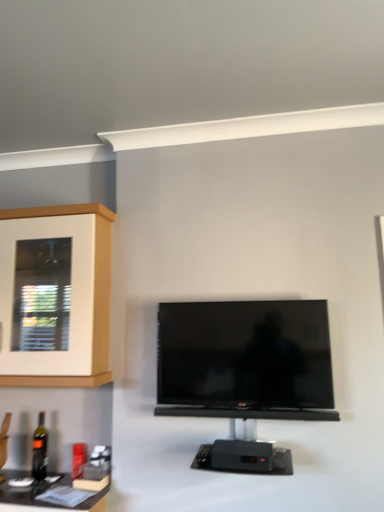
Question: Is black glossy tv at center to the left of black glass bottle at lower left from the viewer's perspective?

Choices:
 (A) yes
 (B) no

Answer: (B)

Question: Would you say black glossy tv at center is a long distance from black glass bottle at lower left?

Choices:
 (A) yes
 (B) no

Answer: (A)

Question: Would you say black glossy tv at center is outside black glass bottle at lower left?

Choices:
 (A) yes
 (B) no

Answer: (A)

Question: Does black glossy tv at center have a smaller size compared to black glass bottle at lower left?

Choices:
 (A) no
 (B) yes

Answer: (A)

Question: Is black glossy tv at center thinner than black glass bottle at lower left?

Choices:
 (A) yes
 (B) no

Answer: (B)

Question: From the image's perspective, would you say black glossy tv at center is shown under black glass bottle at lower left?

Choices:
 (A) no
 (B) yes

Answer: (A)

Question: Is black glass bottle at lower left far away from wooden cabinet at left?

Choices:
 (A) no
 (B) yes

Answer: (A)

Question: Is black glass bottle at lower left positioned beyond the bounds of wooden cabinet at left?

Choices:
 (A) no
 (B) yes

Answer: (B)

Question: Considering the relative positions of black glass bottle at lower left and wooden cabinet at left in the image provided, is black glass bottle at lower left to the left of wooden cabinet at left from the viewer's perspective?

Choices:
 (A) no
 (B) yes

Answer: (B)

Question: From the image's perspective, would you say black glass bottle at lower left is positioned over wooden cabinet at left?

Choices:
 (A) no
 (B) yes

Answer: (A)

Question: From the image's perspective, would you say black glass bottle at lower left is shown under wooden cabinet at left?

Choices:
 (A) yes
 (B) no

Answer: (A)

Question: Can you confirm if black glass bottle at lower left is positioned to the right of wooden cabinet at left?

Choices:
 (A) yes
 (B) no

Answer: (B)

Question: Considering the relative sizes of black glossy tv at center and wooden cabinet at left in the image provided, is black glossy tv at center smaller than wooden cabinet at left?

Choices:
 (A) yes
 (B) no

Answer: (A)